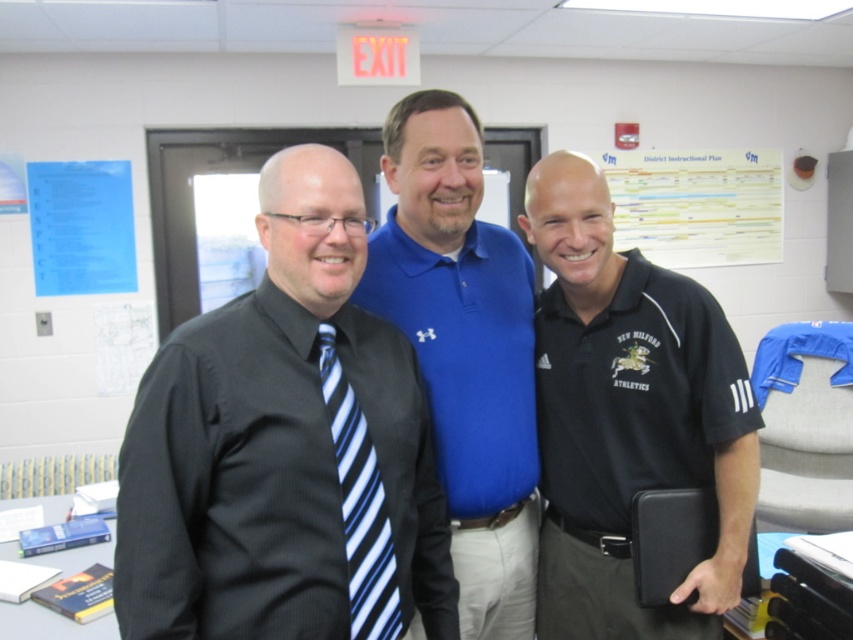
Who is lower down, black matte polo shirt at center or blue cotton polo shirt at center?

black matte polo shirt at center is below.

Between point (583, 314) and point (462, 582), which one is positioned behind?

Point (583, 314)

Where is `black matte polo shirt at center`? The height and width of the screenshot is (640, 853). black matte polo shirt at center is located at coordinates (628, 417).

Can you confirm if black matte polo shirt at center is positioned below blue striped tie at left?

No.

Is black matte polo shirt at center to the right of blue striped tie at left from the viewer's perspective?

Correct, you'll find black matte polo shirt at center to the right of blue striped tie at left.

Find the location of a particular element. black matte polo shirt at center is located at coordinates (628, 417).

Does black smooth shirt at left have a larger size compared to blue cotton polo shirt at center?

Yes, black smooth shirt at left is bigger than blue cotton polo shirt at center.

Can you confirm if black smooth shirt at left is thinner than blue cotton polo shirt at center?

In fact, black smooth shirt at left might be wider than blue cotton polo shirt at center.

At what (x,y) coordinates should I click in order to perform the action: click on black smooth shirt at left. Please return your answer as a coordinate pair (x, y). The width and height of the screenshot is (853, 640). Looking at the image, I should click on (285, 449).